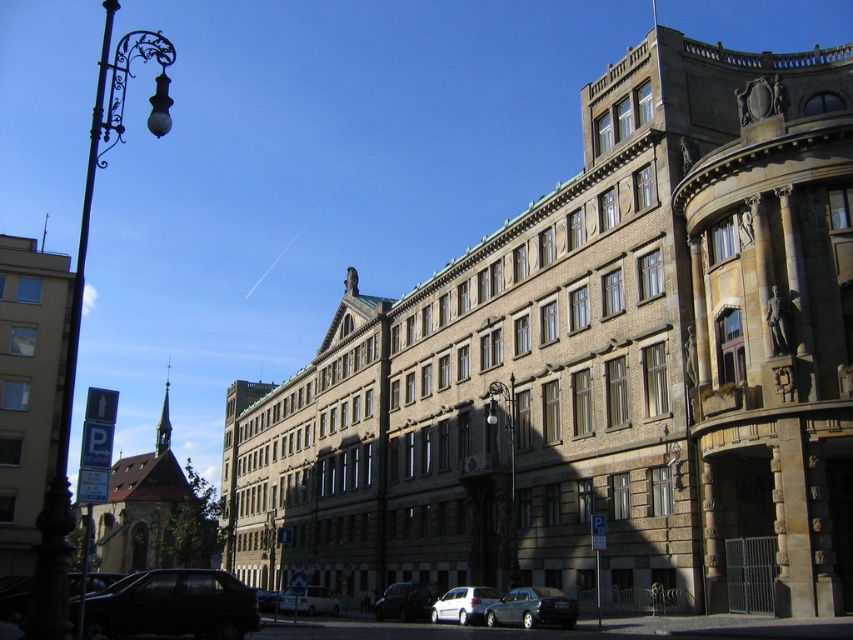
Question: Estimate the real-world distances between objects in this image. Which object is closer to the white matte van at center?

Choices:
 (A) teal metallic sedan at lower center
 (B) black wrought iron streetlight at left

Answer: (A)

Question: Does matte black suv at lower left have a smaller size compared to shiny black car at lower center?

Choices:
 (A) no
 (B) yes

Answer: (A)

Question: Which object is positioned farthest from the black wrought iron streetlight at left?

Choices:
 (A) metallic streetlamp at center
 (B) white matte van at center
 (C) shiny black car at lower center

Answer: (B)

Question: Is teal metallic sedan at lower center to the right of shiny black car at lower center from the viewer's perspective?

Choices:
 (A) no
 (B) yes

Answer: (B)

Question: Estimate the real-world distances between objects in this image. Which object is closer to the black wrought iron streetlight at left?

Choices:
 (A) metallic streetlamp at center
 (B) matte black suv at lower left

Answer: (A)

Question: In this image, where is black wrought iron streetlight at left located relative to silver metallic van at lower center?

Choices:
 (A) left
 (B) right

Answer: (A)